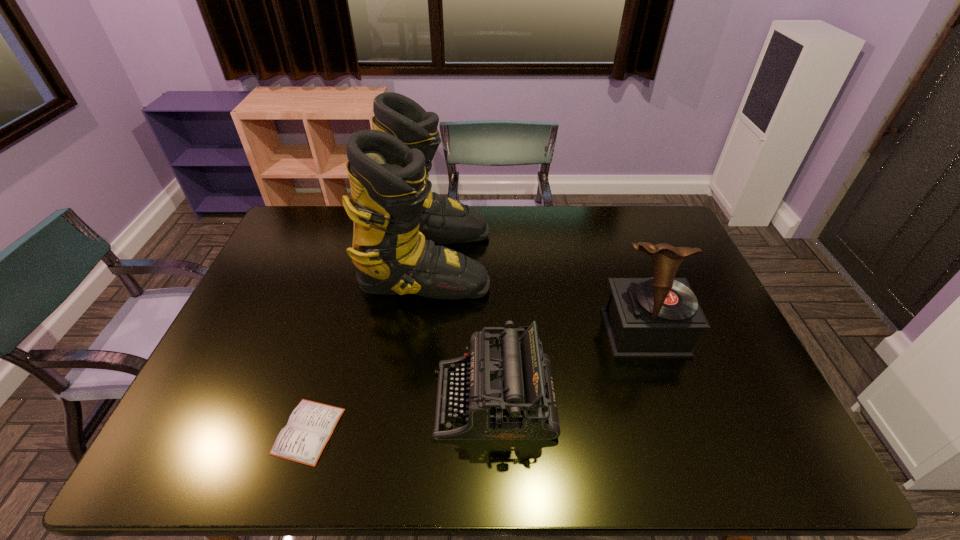
Identify the location of vacant region located 0.130m on the back of the diary. (331, 357).

Locate an element on the screen. The height and width of the screenshot is (540, 960). object at the far edge is located at coordinates (397, 218).

The image size is (960, 540). Identify the location of typewriter at the near edge. (508, 393).

In order to click on diary at the near edge in this screenshot , I will do `click(311, 424)`.

I want to click on object that is at the right edge, so click(659, 317).

Where is `vacant area at the far edge`? vacant area at the far edge is located at coordinates (485, 212).

The height and width of the screenshot is (540, 960). I want to click on vacant area at the near edge, so click(x=408, y=450).

In the image, there is a desktop. What are the coordinates of `free space at the left edge` in the screenshot? It's located at (242, 336).

What are the coordinates of `vacant space at the right edge of the desktop` in the screenshot? It's located at (714, 416).

This screenshot has width=960, height=540. I want to click on vacant space at the far left corner of the desktop, so click(329, 216).